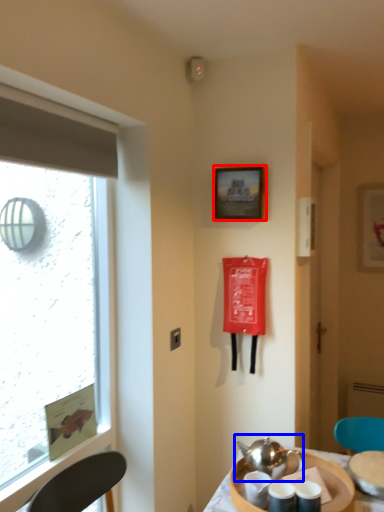
Question: Which of the following is the closest to the observer, picture frame (highlighted by a red box) or tea set (highlighted by a blue box)?

Choices:
 (A) picture frame
 (B) tea set

Answer: (B)